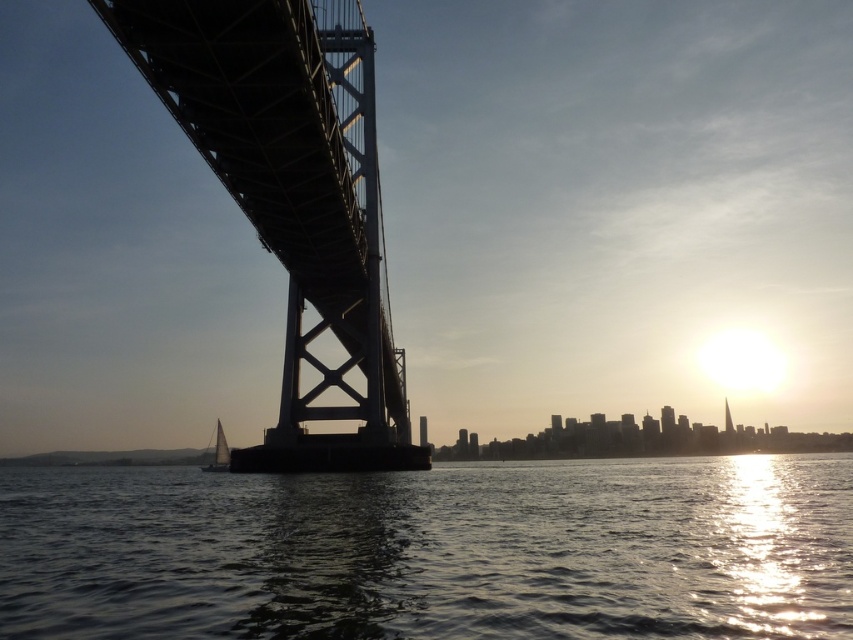
You are standing on a pier and want to take a photo of the silhouette steel bridge at left. The camera you have can only focus on objects within 20 meters. Will the bridge be in focus?

The silhouette steel bridge at left is 23.28 meters from viewer, which is beyond the camera focus range of 20 meters. The bridge will not be in focus.

You are an artist trying to paint the waterfront scene. You want to ensure the shiny dark water at center and the silhouette steel bridge at left are proportionally accurate. Which object should you paint larger in your artwork?

The shiny dark water at center should be painted larger than the silhouette steel bridge at left because it is bigger in the scene.